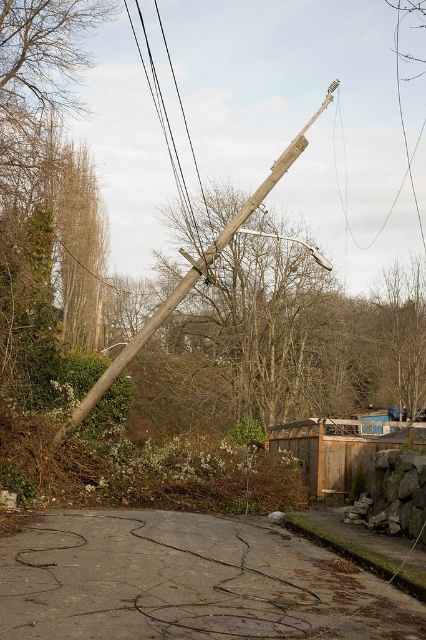
Question: Which object is closer to the camera taking this photo?

Choices:
 (A) brown wooden fence at center
 (B) concrete pavement at center
 (C) black wire at upper center

Answer: (B)

Question: Based on their relative distances, which object is nearer to the wooden telegraph pole at center?

Choices:
 (A) black wire at upper center
 (B) concrete pavement at center

Answer: (A)

Question: Considering the relative positions of concrete pavement at center and black wire at upper center in the image provided, where is concrete pavement at center located with respect to black wire at upper center?

Choices:
 (A) right
 (B) left

Answer: (A)

Question: Estimate the real-world distances between objects in this image. Which object is closer to the concrete pavement at center?

Choices:
 (A) wooden telegraph pole at center
 (B) brown wooden fence at center

Answer: (B)

Question: Can you confirm if wooden telegraph pole at center is thinner than black wire at upper center?

Choices:
 (A) yes
 (B) no

Answer: (B)

Question: Is wooden telegraph pole at center bigger than black wire at upper center?

Choices:
 (A) yes
 (B) no

Answer: (A)